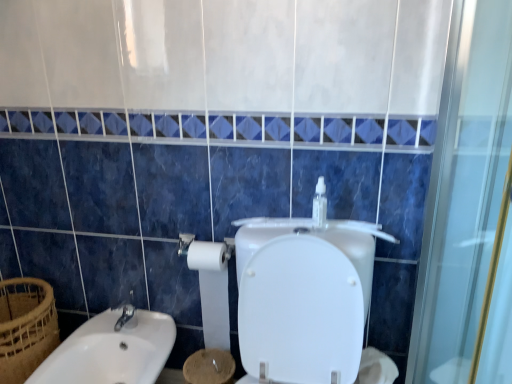
Question: Is white glossy sink at lower left outside of clear plastic bottle at upper center?

Choices:
 (A) yes
 (B) no

Answer: (A)

Question: Does white glossy sink at lower left have a greater width compared to clear plastic bottle at upper center?

Choices:
 (A) yes
 (B) no

Answer: (A)

Question: Is white glossy sink at lower left further to the viewer compared to clear plastic bottle at upper center?

Choices:
 (A) yes
 (B) no

Answer: (B)

Question: Is clear plastic bottle at upper center at the back of white glossy sink at lower left?

Choices:
 (A) yes
 (B) no

Answer: (B)

Question: Is clear plastic bottle at upper center located within white glossy sink at lower left?

Choices:
 (A) yes
 (B) no

Answer: (B)

Question: From a real-world perspective, is white glossy sink at lower left physically below clear plastic bottle at upper center?

Choices:
 (A) yes
 (B) no

Answer: (A)

Question: Is clear plastic bottle at upper center turned away from white glossy sink at lower left?

Choices:
 (A) yes
 (B) no

Answer: (B)

Question: Is clear plastic bottle at upper center to the left of white glossy sink at lower left from the viewer's perspective?

Choices:
 (A) yes
 (B) no

Answer: (B)

Question: Considering the relative sizes of clear plastic bottle at upper center and white glossy sink at lower left in the image provided, is clear plastic bottle at upper center smaller than white glossy sink at lower left?

Choices:
 (A) no
 (B) yes

Answer: (B)

Question: Is clear plastic bottle at upper center behind white glossy sink at lower left?

Choices:
 (A) no
 (B) yes

Answer: (B)

Question: From a real-world perspective, is clear plastic bottle at upper center under white glossy sink at lower left?

Choices:
 (A) yes
 (B) no

Answer: (B)

Question: Is the position of clear plastic bottle at upper center less distant than that of white glossy sink at lower left?

Choices:
 (A) yes
 (B) no

Answer: (B)

Question: Are brown woven basket at lower left and clear plastic bottle at upper center far apart?

Choices:
 (A) no
 (B) yes

Answer: (B)